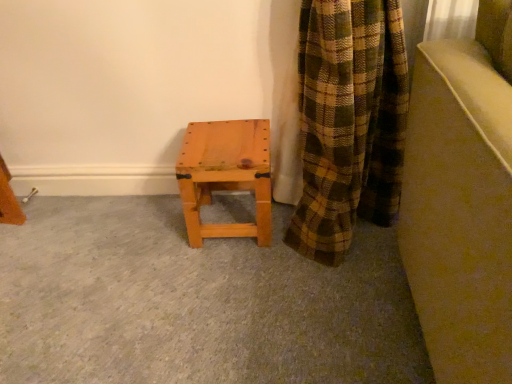
At what (x,y) coordinates should I click in order to perform the action: click on natural wood stool at center. Please return your answer as a coordinate pair (x, y). Looking at the image, I should click on (225, 175).

What do you see at coordinates (225, 175) in the screenshot? I see `natural wood stool at center` at bounding box center [225, 175].

Identify the location of natural wood stool at center. (225, 175).